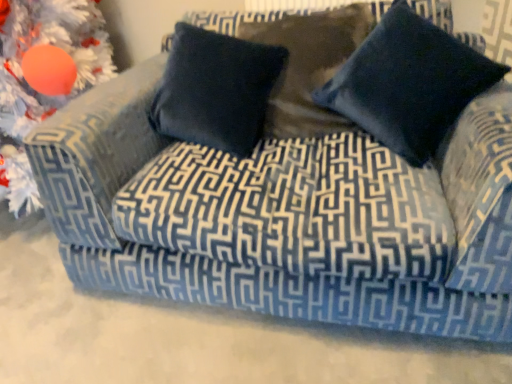
Question: Can you confirm if navy blue velvet pillow at center, the first pillow positioned from the left, is thinner than orange matte ornament at upper left?

Choices:
 (A) no
 (B) yes

Answer: (B)

Question: From the image's perspective, is navy blue velvet pillow at center, the first pillow positioned from the left, below orange matte ornament at upper left?

Choices:
 (A) yes
 (B) no

Answer: (B)

Question: Is navy blue velvet pillow at center, positioned as the second pillow in right-to-left order, closer to the viewer compared to orange matte ornament at upper left?

Choices:
 (A) no
 (B) yes

Answer: (A)

Question: Is the depth of navy blue velvet pillow at center, the first pillow positioned from the left, greater than that of orange matte ornament at upper left?

Choices:
 (A) no
 (B) yes

Answer: (B)

Question: From a real-world perspective, does navy blue velvet pillow at center, positioned as the second pillow in right-to-left order, sit lower than orange matte ornament at upper left?

Choices:
 (A) yes
 (B) no

Answer: (B)

Question: From the image's perspective, is navy blue velvet pillow at center, the first pillow positioned from the left, on orange matte ornament at upper left?

Choices:
 (A) no
 (B) yes

Answer: (B)

Question: Considering the relative sizes of orange matte ornament at upper left and navy blue velvet pillow at center, positioned as the second pillow in right-to-left order, in the image provided, is orange matte ornament at upper left thinner than navy blue velvet pillow at center, positioned as the second pillow in right-to-left order,?

Choices:
 (A) yes
 (B) no

Answer: (B)

Question: Is orange matte ornament at upper left wider than navy blue velvet pillow at center, the first pillow positioned from the left?

Choices:
 (A) no
 (B) yes

Answer: (B)

Question: Is orange matte ornament at upper left not within navy blue velvet pillow at center, the first pillow positioned from the left?

Choices:
 (A) no
 (B) yes

Answer: (B)

Question: Does orange matte ornament at upper left appear on the left side of navy blue velvet pillow at center, positioned as the second pillow in right-to-left order?

Choices:
 (A) no
 (B) yes

Answer: (B)

Question: Is orange matte ornament at upper left bigger than navy blue velvet pillow at center, positioned as the second pillow in right-to-left order?

Choices:
 (A) yes
 (B) no

Answer: (A)

Question: Can you confirm if orange matte ornament at upper left is shorter than navy blue velvet pillow at center, positioned as the second pillow in right-to-left order?

Choices:
 (A) yes
 (B) no

Answer: (B)

Question: Can you confirm if orange matte ornament at upper left is positioned to the left of navy velvet pillow at upper right, the 2th pillow in the left-to-right sequence?

Choices:
 (A) yes
 (B) no

Answer: (A)